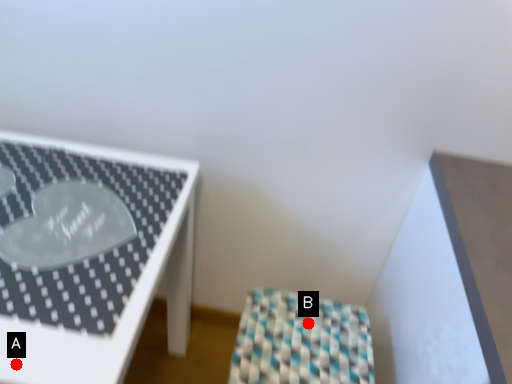
Question: Two points are circled on the image, labeled by A and B beside each circle. Which point appears farthest from the camera in this image?

Choices:
 (A) A is further
 (B) B is further

Answer: (B)